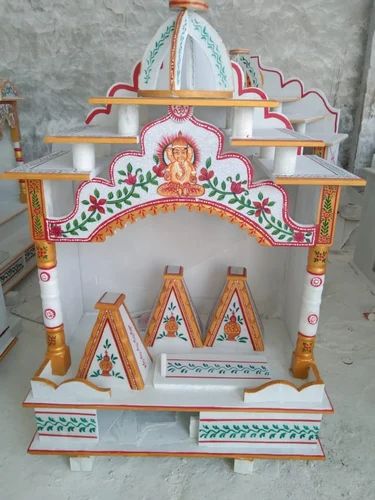
Identify the location of floor. (346, 431), (347, 445).